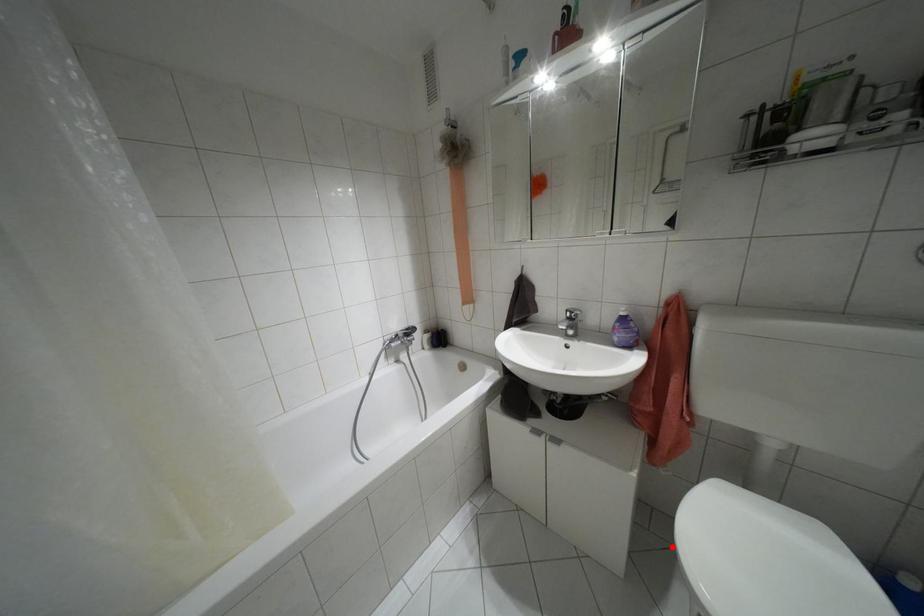
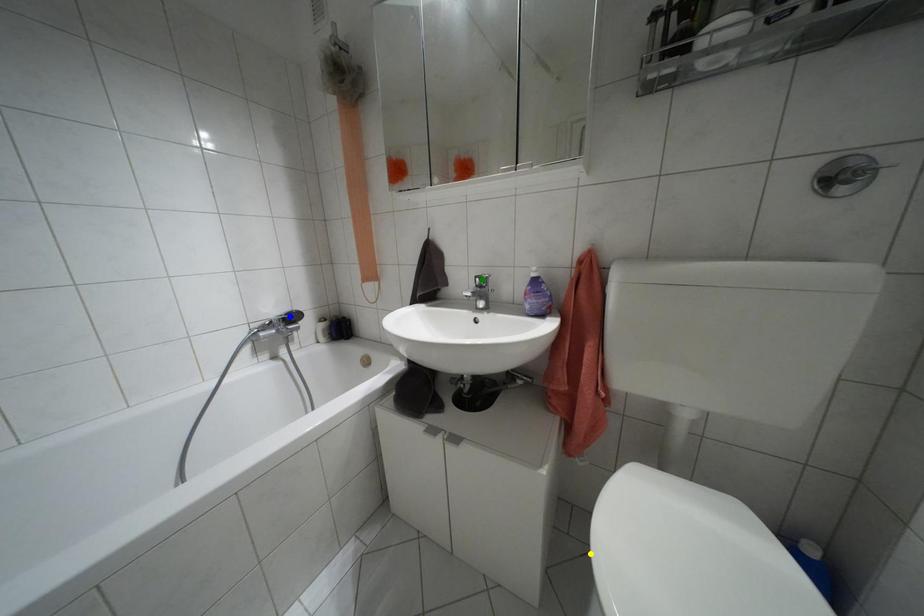
Question: I am providing you with two images of the same scene from different viewpoints. A red point is marked on the first image. You are given multiple points on the second image. Which point in image 2 is actually the same real-world point as the red point in image 1?

Choices:
 (A) blue point
 (B) yellow point
 (C) green point

Answer: (B)